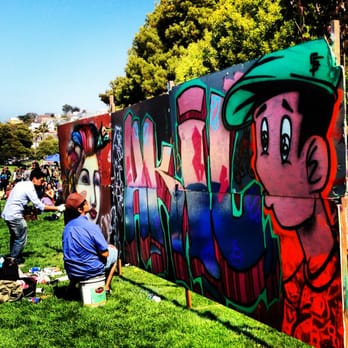
Locate an element on the screen. This screenshot has height=348, width=348. leftmost side of wall is located at coordinates (66, 157).